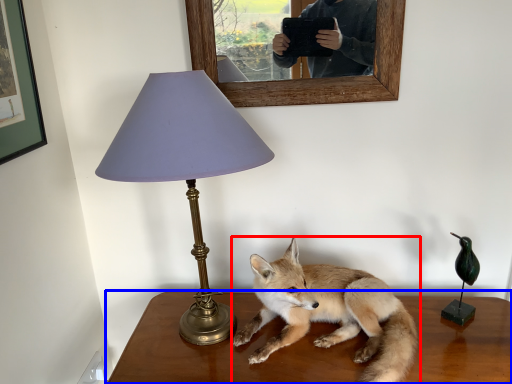
Question: Among these objects, which one is farthest to the camera, fox (highlighted by a red box) or table (highlighted by a blue box)?

Choices:
 (A) fox
 (B) table

Answer: (B)